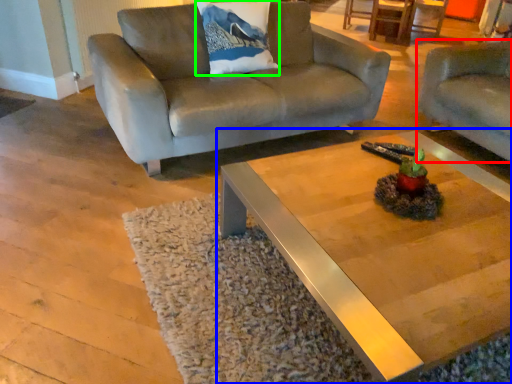
Question: Which object is positioned closest to studio couch (highlighted by a red box)? Select from coffee table (highlighted by a blue box) and pillow (highlighted by a green box).

Choices:
 (A) coffee table
 (B) pillow

Answer: (B)